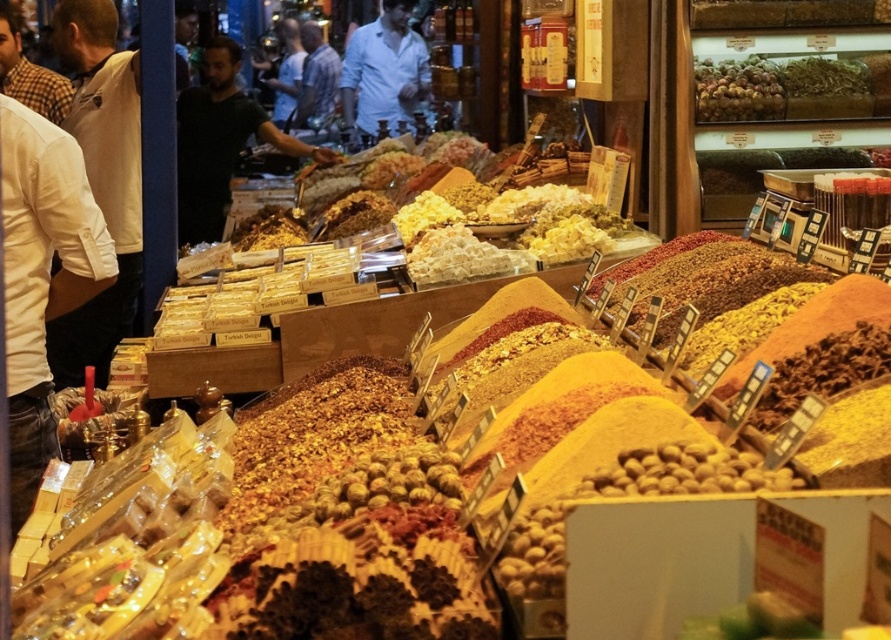
Question: Among these objects, which one is nearest to the camera?

Choices:
 (A) dark blue shirt at center
 (B) green leafy vegetables at upper right

Answer: (B)

Question: Which object appears closest to the camera in this image?

Choices:
 (A) light brown shirt at left
 (B) black matte shirt at center

Answer: (A)

Question: Can you confirm if black matte shirt at center is smaller than light blue shirt at center?

Choices:
 (A) no
 (B) yes

Answer: (A)

Question: Is black matte shirt at center below light blue shirt at center?

Choices:
 (A) no
 (B) yes

Answer: (B)

Question: Among these objects, which one is farthest from the camera?

Choices:
 (A) green leafy vegetables at upper right
 (B) white shirt at left
 (C) light blue shirt at center

Answer: (C)

Question: Can you confirm if green leafy vegetables at upper right is positioned below light brown shirt at left?

Choices:
 (A) no
 (B) yes

Answer: (B)